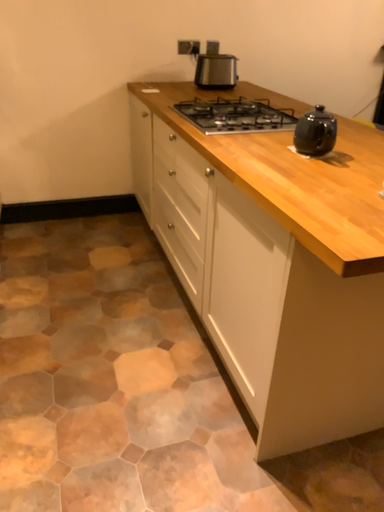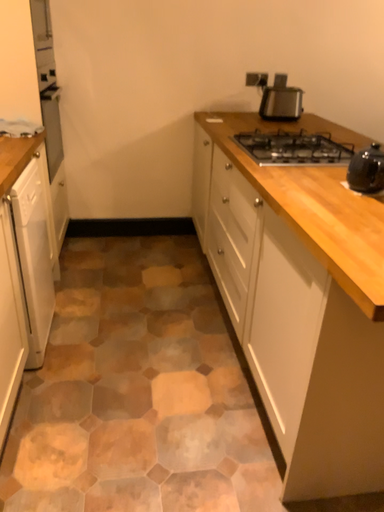
Question: How did the camera likely rotate when shooting the video?

Choices:
 (A) rotated right
 (B) rotated left

Answer: (B)